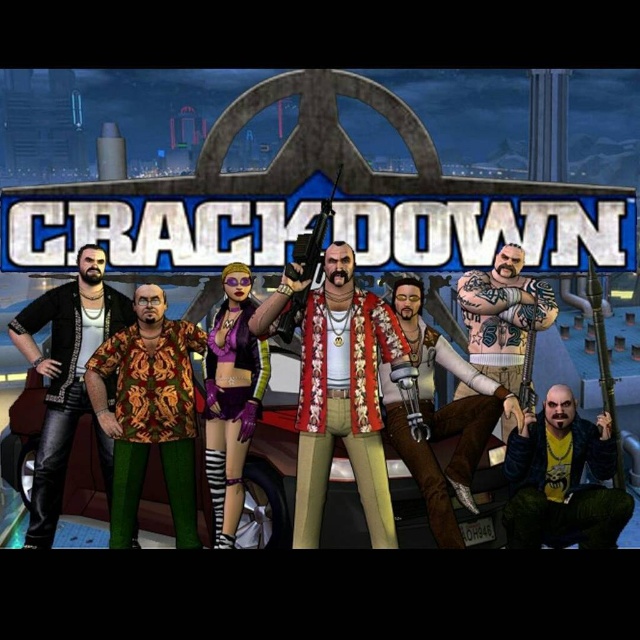
Does reddish-brown leather jacket at center have a greater height compared to yellow-green leather jacket at lower right?

Yes, reddish-brown leather jacket at center is taller than yellow-green leather jacket at lower right.

Does point (348, 326) come closer to viewer compared to point (518, 488)?

No.

Locate an element on the screen. The height and width of the screenshot is (640, 640). reddish-brown leather jacket at center is located at coordinates (342, 397).

From the picture: Between printed fabric shirt at center and metallic silver gun at center, which one has more height?

metallic silver gun at center is taller.

Is point (120, 544) positioned before point (282, 314)?

That is False.

The image size is (640, 640). I want to click on printed fabric shirt at center, so click(x=148, y=413).

Does leather jacket at center have a lesser width compared to purple matte/soft fabric at center?

No.

Based on the photo, who is more distant from viewer, (x=445, y=429) or (x=232, y=506)?

Point (x=232, y=506)

Find the location of `leather jacket at center`. leather jacket at center is located at coordinates (440, 417).